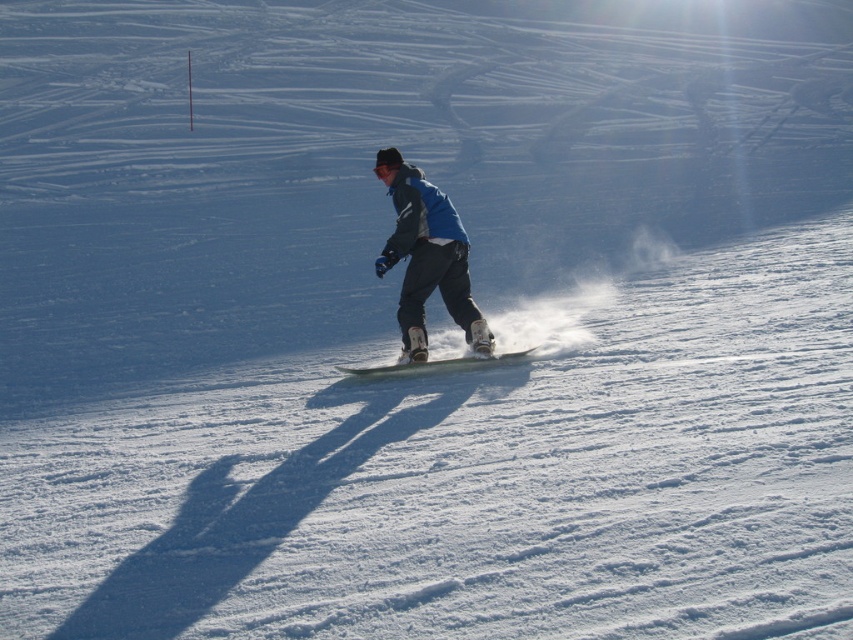
Can you confirm if matte blue snowboarder at center is shorter than white matte snowboard at center?

No.

Locate an element on the screen. The image size is (853, 640). matte blue snowboarder at center is located at coordinates (426, 266).